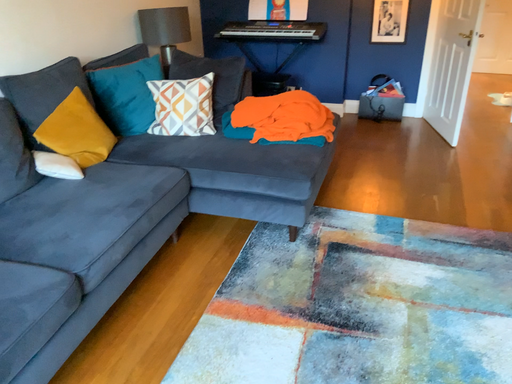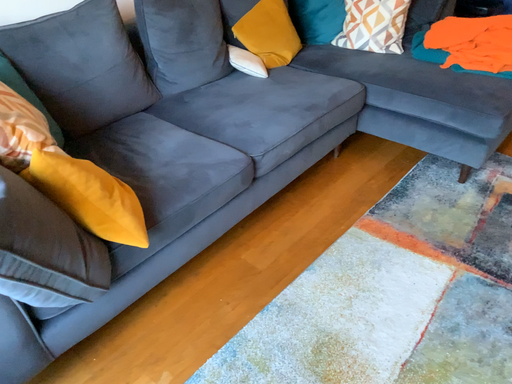
Question: Which way did the camera rotate in the video?

Choices:
 (A) rotated left
 (B) rotated right

Answer: (A)